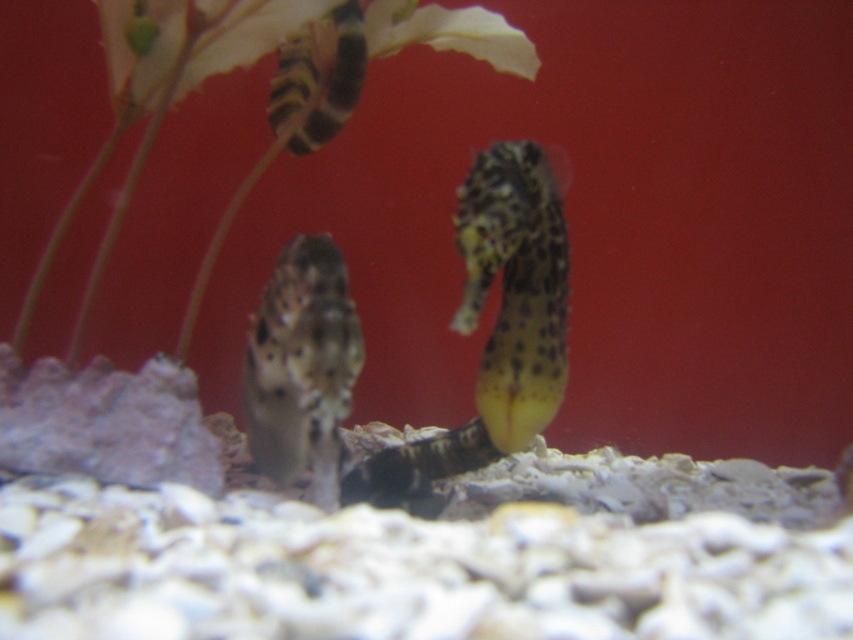
Question: Which of these objects is positioned farthest from the green leafy plant at upper center?

Choices:
 (A) speckled seahorse at center
 (B) spotted seahorse at center

Answer: (B)

Question: Is green leafy plant at upper center bigger than spotted seahorse at center?

Choices:
 (A) yes
 (B) no

Answer: (A)

Question: Can you confirm if green leafy plant at upper center is thinner than spotted seahorse at center?

Choices:
 (A) yes
 (B) no

Answer: (B)

Question: Is green leafy plant at upper center smaller than speckled seahorse at center?

Choices:
 (A) yes
 (B) no

Answer: (B)

Question: Considering the real-world distances, which object is farthest from the green leafy plant at upper center?

Choices:
 (A) spotted seahorse at center
 (B) speckled seahorse at center

Answer: (A)

Question: Which of these objects is positioned closest to the spotted seahorse at center?

Choices:
 (A) speckled seahorse at center
 (B) green leafy plant at upper center

Answer: (A)